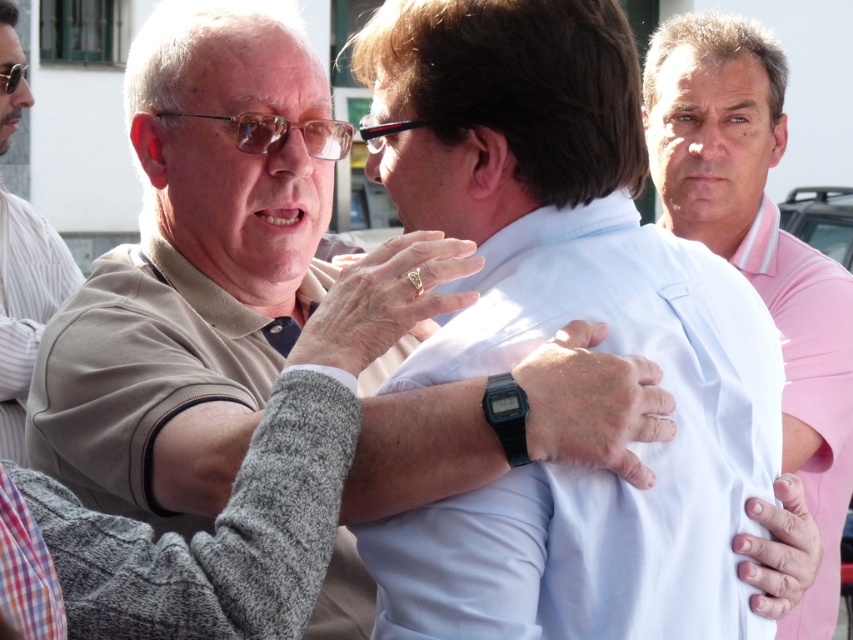
Question: Can you confirm if pink cotton polo shirt at center is smaller than beige fabric shirt at left?

Choices:
 (A) yes
 (B) no

Answer: (B)

Question: Is white smooth shirt at center positioned at the back of beige fabric shirt at left?

Choices:
 (A) no
 (B) yes

Answer: (A)

Question: Does pink cotton polo shirt at center lie in front of beige fabric shirt at left?

Choices:
 (A) yes
 (B) no

Answer: (A)

Question: Among these points, which one is nearest to the camera?

Choices:
 (A) (21, 342)
 (B) (711, 300)

Answer: (B)

Question: Which point is closer to the camera?

Choices:
 (A) beige fabric shirt at left
 (B) white smooth shirt at center

Answer: (B)

Question: Among these points, which one is farthest from the camera?

Choices:
 (A) (596, 154)
 (B) (35, 298)

Answer: (B)